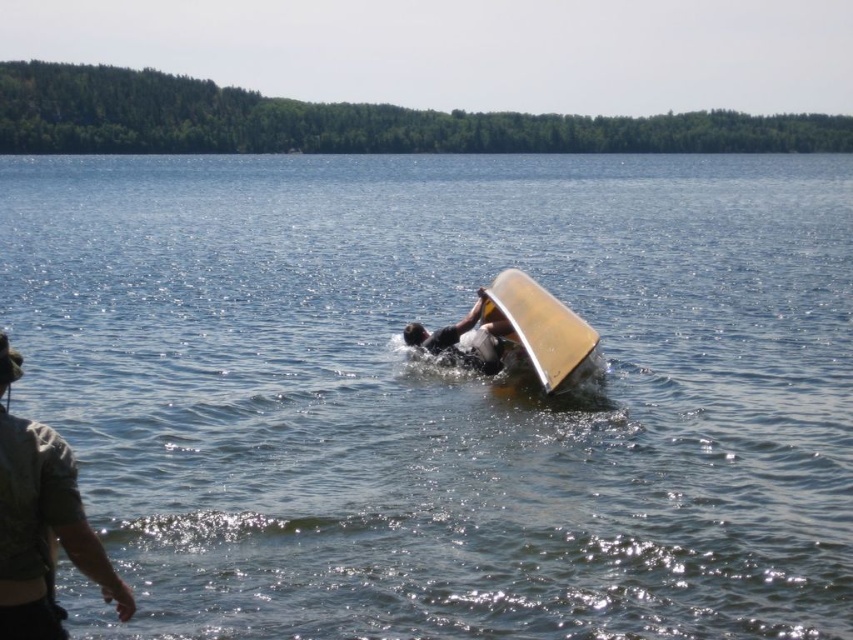
Question: Which point is closer to the camera?

Choices:
 (A) transparent plastic surfboard at center
 (B) dark gray matte surfboard at center

Answer: (B)

Question: Can you confirm if camouflage fabric shirt at left is smaller than dark gray matte surfboard at center?

Choices:
 (A) yes
 (B) no

Answer: (A)

Question: Which point is farther from the camera taking this photo?

Choices:
 (A) (553, 296)
 (B) (498, 346)
 (C) (76, 554)

Answer: (A)

Question: Which point is closer to the camera taking this photo?

Choices:
 (A) (466, 353)
 (B) (549, 332)
 (C) (32, 612)

Answer: (C)

Question: Does camouflage fabric shirt at left appear over transparent plastic surfboard at center?

Choices:
 (A) yes
 (B) no

Answer: (B)

Question: Does camouflage fabric shirt at left have a lesser width compared to transparent plastic surfboard at center?

Choices:
 (A) yes
 (B) no

Answer: (B)